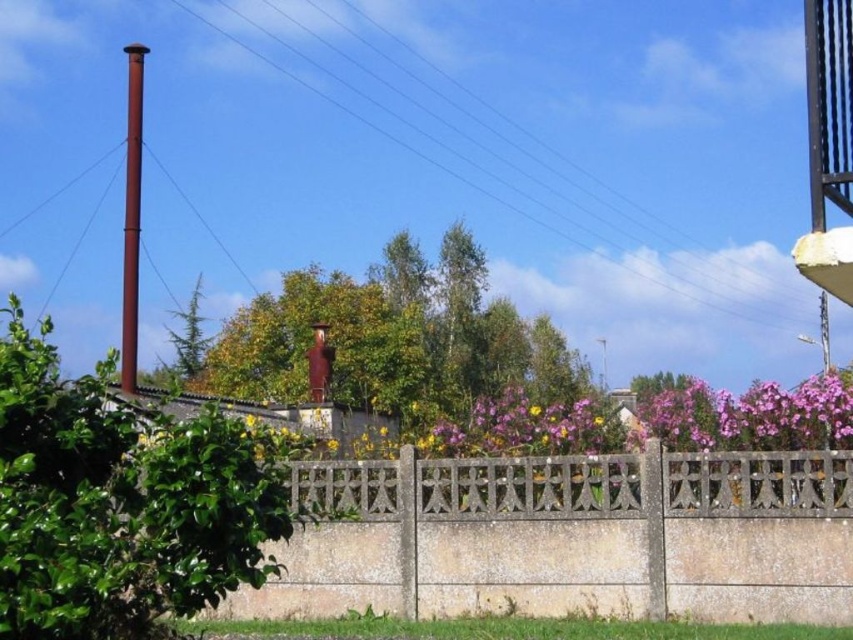
Question: In this image, where is concrete textured fence at center located relative to rusty metal pole at left?

Choices:
 (A) left
 (B) right

Answer: (B)

Question: Can you confirm if metallic wire at upper center is positioned above rusty metal pole at left?

Choices:
 (A) no
 (B) yes

Answer: (B)

Question: Considering the real-world distances, which object is farthest from the rusty metal pole at left?

Choices:
 (A) metallic wire at upper center
 (B) concrete textured fence at center

Answer: (B)

Question: Which point appears closest to the camera in this image?

Choices:
 (A) (618, 548)
 (B) (132, 164)
 (C) (223, 29)

Answer: (A)

Question: Does metallic wire at upper center have a lesser width compared to rusty metal pole at left?

Choices:
 (A) no
 (B) yes

Answer: (A)

Question: Among these objects, which one is nearest to the camera?

Choices:
 (A) metallic wire at upper center
 (B) concrete textured fence at center
 (C) rusty metal pole at left

Answer: (B)